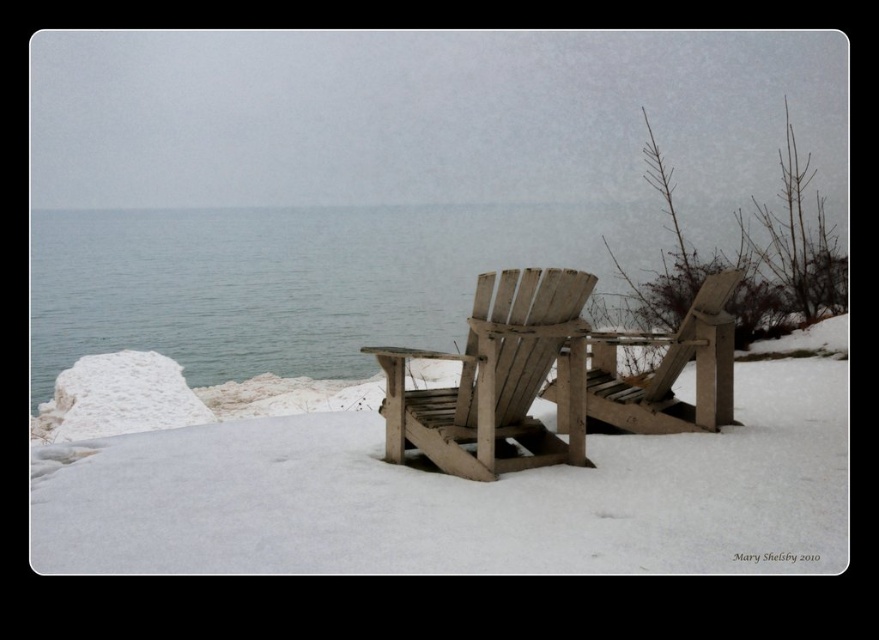
You are standing on the snow near the two wooden Adirondack chairs in the foreground. You want to walk to the wooden beach chair at center. Which direction should you walk to avoid stepping into the clear water at center?

You should walk to the left of the wooden beach chair at center because the clear water at center is above it, so stepping to the left would avoid the water.